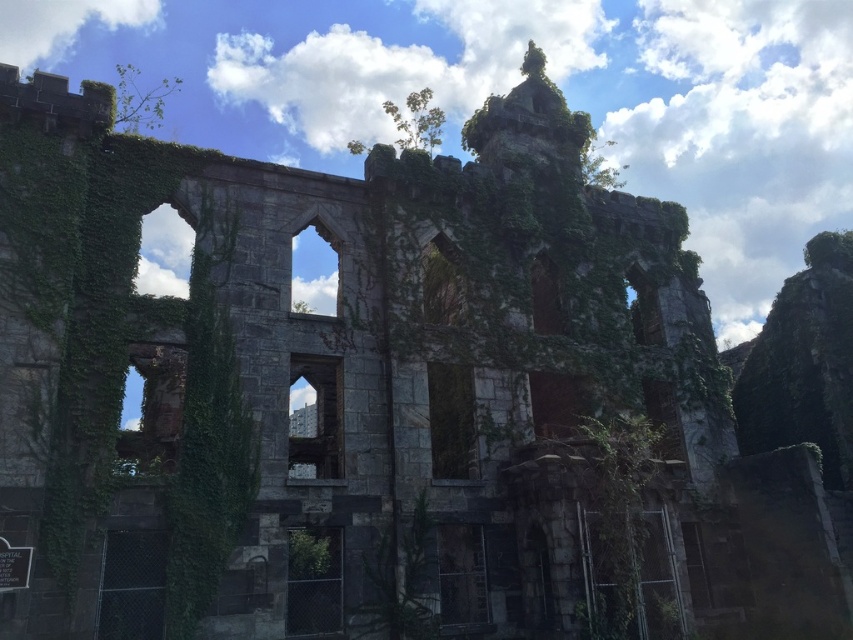
Question: Does green leafy tree at upper left have a smaller size compared to green leafy tree at upper center?

Choices:
 (A) yes
 (B) no

Answer: (B)

Question: Among these points, which one is nearest to the camera?

Choices:
 (A) (416, 92)
 (B) (134, 120)

Answer: (A)

Question: Does green leafy tree at upper left appear on the left side of green leafy tree at upper center?

Choices:
 (A) yes
 (B) no

Answer: (A)

Question: Can you confirm if green leafy tree at upper left is positioned to the right of green leafy tree at upper center?

Choices:
 (A) yes
 (B) no

Answer: (B)